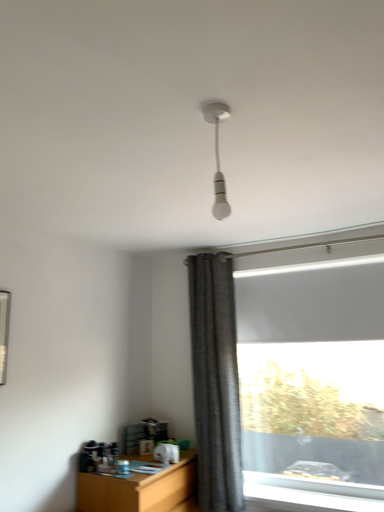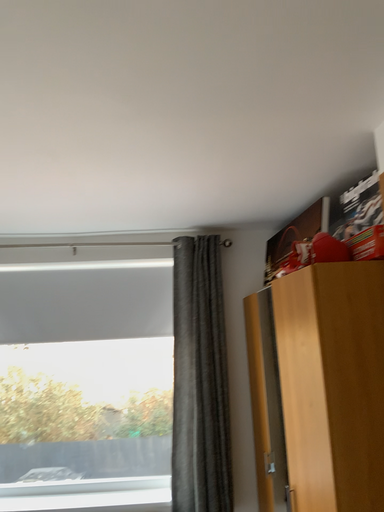
Question: How did the camera likely rotate when shooting the video?

Choices:
 (A) rotated right
 (B) rotated left

Answer: (A)